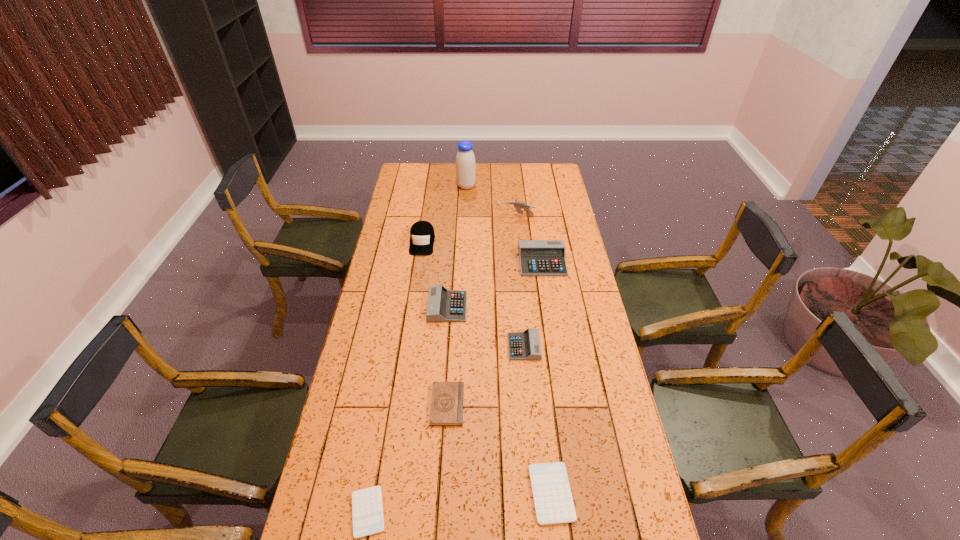
Find the location of a particular element. soya milk is located at coordinates (465, 160).

Locate an element on the screen. blue soya milk is located at coordinates (465, 160).

Locate an element on the screen. This screenshot has height=540, width=960. the second farthest object is located at coordinates (518, 205).

Identify the location of cap. Image resolution: width=960 pixels, height=540 pixels. (422, 236).

You are a GUI agent. You are given a task and a screenshot of the screen. Output one action in this format:
    pyautogui.click(x=<x>, y=<y>)
    Task: Click on the tallest calculator
    The height and width of the screenshot is (540, 960).
    Given the screenshot: What is the action you would take?
    pyautogui.click(x=537, y=257)

Locate an element on the screen. The width and height of the screenshot is (960, 540). the farthest gray calculator is located at coordinates pyautogui.click(x=537, y=257).

Locate an element on the screen. The image size is (960, 540). the fifth shortest object is located at coordinates (443, 305).

Find the location of a particular element. The height and width of the screenshot is (540, 960). the leftmost gray calculator is located at coordinates (443, 305).

Where is `the sixth farthest object`? Image resolution: width=960 pixels, height=540 pixels. the sixth farthest object is located at coordinates (525, 345).

You are a GUI agent. You are given a task and a screenshot of the screen. Output one action in this format:
    pyautogui.click(x=<x>, y=<y>)
    Task: Click on the smallest gray calculator
    The width and height of the screenshot is (960, 540).
    Given the screenshot: What is the action you would take?
    pyautogui.click(x=525, y=345)